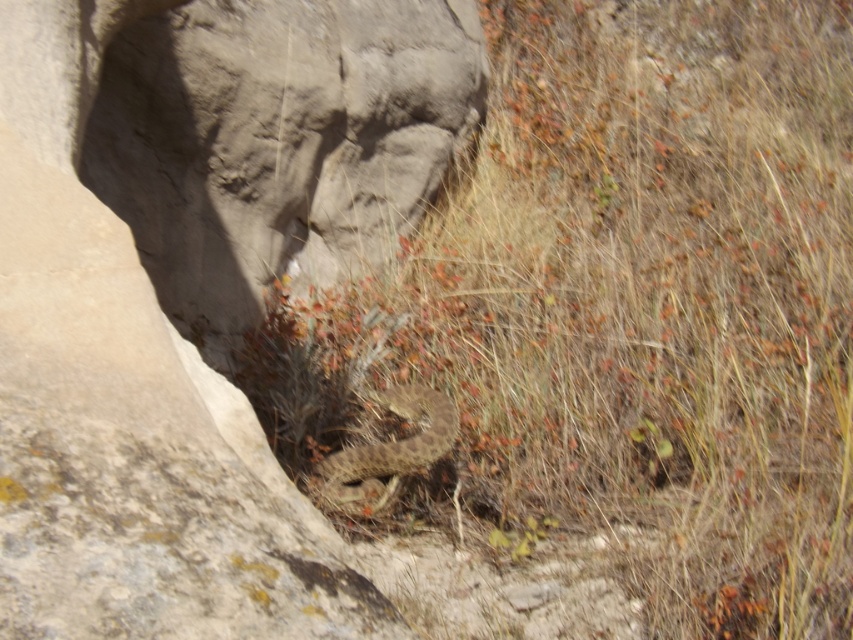
Can you confirm if brown dry grass at center is bigger than brown scaly snake at center?

Yes, brown dry grass at center is bigger than brown scaly snake at center.

Measure the distance between brown dry grass at center and camera.

brown dry grass at center and camera are 6.95 feet apart.

Which is behind, point (546, 148) or point (415, 397)?

The point (546, 148) is more distant.

The image size is (853, 640). I want to click on brown dry grass at center, so click(x=625, y=312).